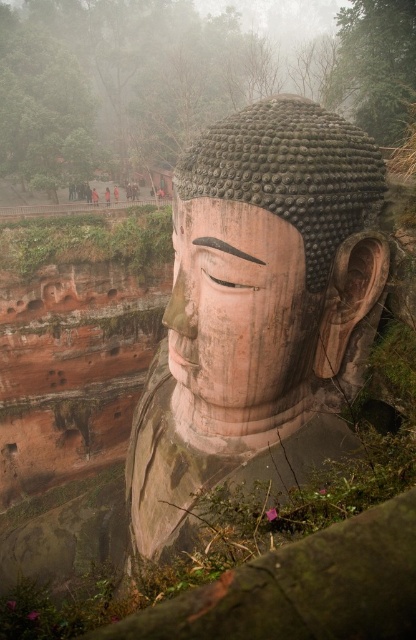
Who is positioned more to the left, smooth stone head at center or smooth stone face at center?

smooth stone face at center is more to the left.

Measure the distance between point (272, 268) and camera.

Point (272, 268) and camera are 43.87 feet apart from each other.

Is point (373, 236) farther from viewer compared to point (260, 246)?

That is True.

At what (x,y) coordinates should I click in order to perform the action: click on smooth stone head at center. Please return your answer as a coordinate pair (x, y). The image size is (416, 640). Looking at the image, I should click on (272, 253).